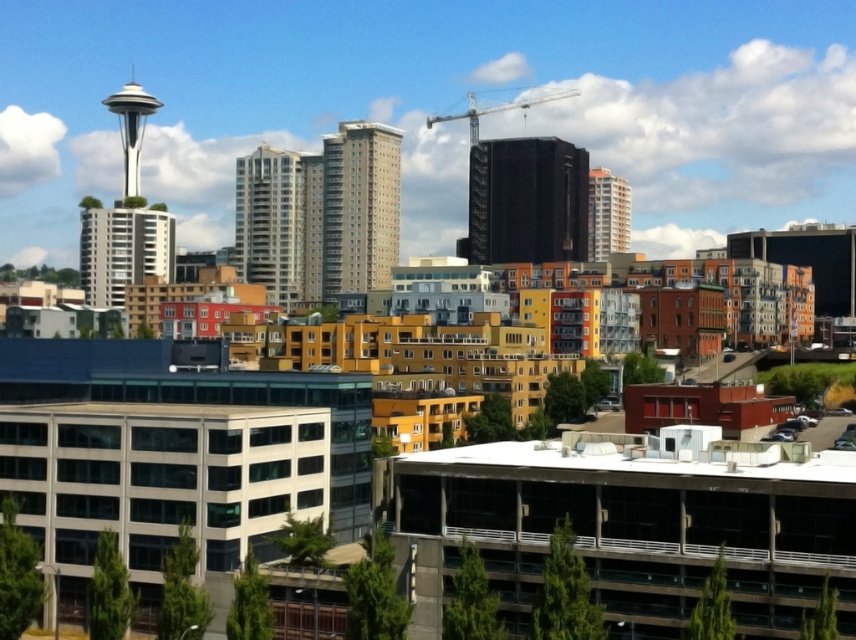
Who is positioned more to the right, black glass building at center or white glossy space needle at upper left?

Positioned to the right is black glass building at center.

Who is lower down, black glass building at center or white glossy space needle at upper left?

black glass building at center

The height and width of the screenshot is (640, 856). What do you see at coordinates (527, 200) in the screenshot?
I see `black glass building at center` at bounding box center [527, 200].

Find the location of `black glass building at center`. black glass building at center is located at coordinates (527, 200).

Consider the image. Does matte glass building at center have a greater width compared to polished stainless steel space needle at upper left?

Incorrect, matte glass building at center's width does not surpass polished stainless steel space needle at upper left's.

Is point (289, 198) farther from camera compared to point (135, 124)?

No.

Identify the location of matte glass building at center. (271, 224).

Between white glossy building at center and metallic gray crane at upper center, which one is positioned lower?

Positioned lower is white glossy building at center.

Between point (604, 204) and point (489, 113), which one is positioned behind?

The point (489, 113) is behind.

Is point (626, 212) closer to camera compared to point (550, 99)?

Yes.

You are a GUI agent. You are given a task and a screenshot of the screen. Output one action in this format:
    pyautogui.click(x=<x>, y=<y>)
    Task: Click on the white glossy building at center
    The width and height of the screenshot is (856, 640).
    Given the screenshot: What is the action you would take?
    pyautogui.click(x=607, y=214)